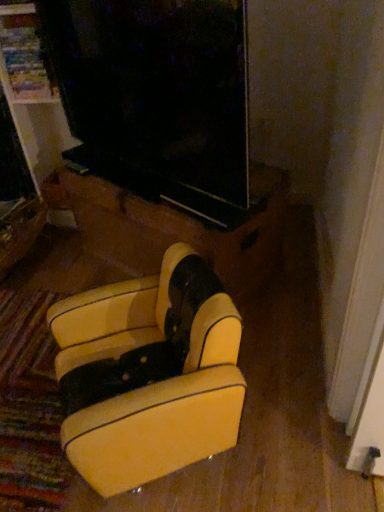
Find the location of a particular element. The image size is (384, 512). vacant region to the left of yellow leather armchair at lower center, the 1th furniture viewed from the front is located at coordinates (35, 432).